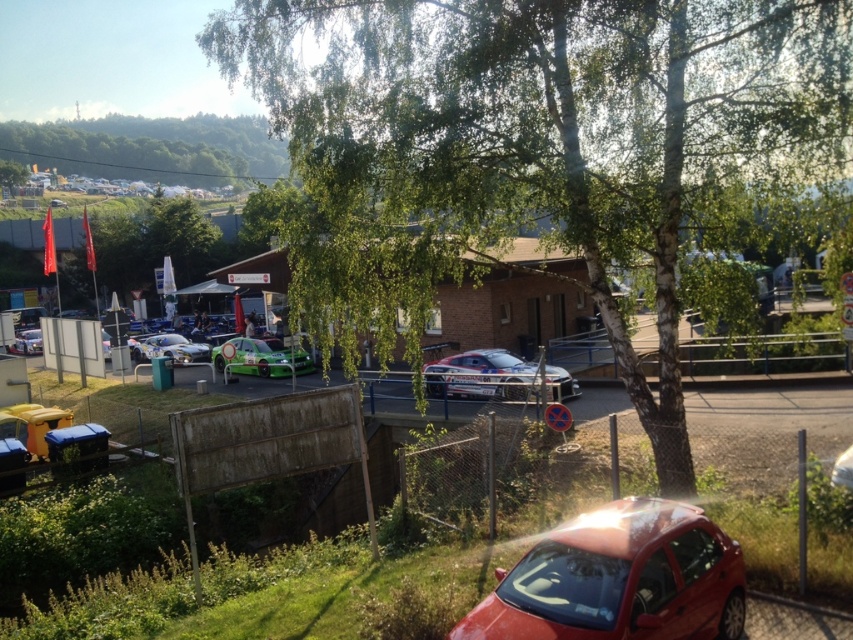
Question: Among these objects, which one is nearest to the camera?

Choices:
 (A) green leafy tree at upper left
 (B) green matte car at center

Answer: (B)

Question: Can you confirm if shiny metallic car at center-left is positioned below metallic silver car at lower left?

Choices:
 (A) no
 (B) yes

Answer: (B)

Question: Considering the relative positions of shiny red car at lower right and shiny metallic race car at center in the image provided, where is shiny red car at lower right located with respect to shiny metallic race car at center?

Choices:
 (A) left
 (B) right

Answer: (B)

Question: Does green leafy tree at upper left appear on the right side of green matte car at center?

Choices:
 (A) no
 (B) yes

Answer: (A)

Question: Which object is closer to the camera taking this photo?

Choices:
 (A) green leafy tree at center
 (B) shiny metallic car at center-left
 (C) shiny metallic race car at center
 (D) shiny red car at lower right

Answer: (D)

Question: Which of the following is the closest to the observer?

Choices:
 (A) green leafy tree at upper center
 (B) shiny metallic race car at center
 (C) shiny metallic car at center-left
 (D) green leafy tree at upper left

Answer: (B)